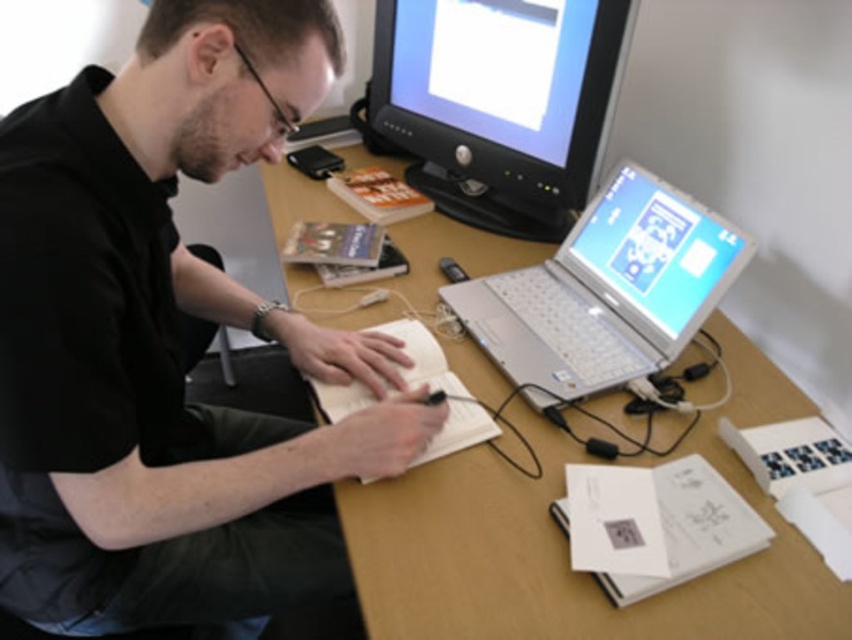
You are trying to determine if the black matte shirt at upper left can cover the matte black monitor at upper center completely. Based on their widths, is this possible?

The black matte shirt at upper left might be wider than matte black monitor at upper center, so it could potentially cover the monitor if positioned correctly.

You are an observer looking at the workspace. Which object is closer to the bottom of the image, the black matte shirt at upper left or the silver metallic laptop at center?

The black matte shirt at upper left is positioned under the silver metallic laptop at center, so the silver metallic laptop at center is closer to the bottom of the image.

You are a delivery robot with a 24 inch wide package. You need to place it between the black matte shirt at upper left and the matte black monitor at upper center. Is there enough space?

The distance between the black matte shirt at upper left and the matte black monitor at upper center is 24.62 inches. Since the package is 24 inches wide, there is enough space to place it between them.